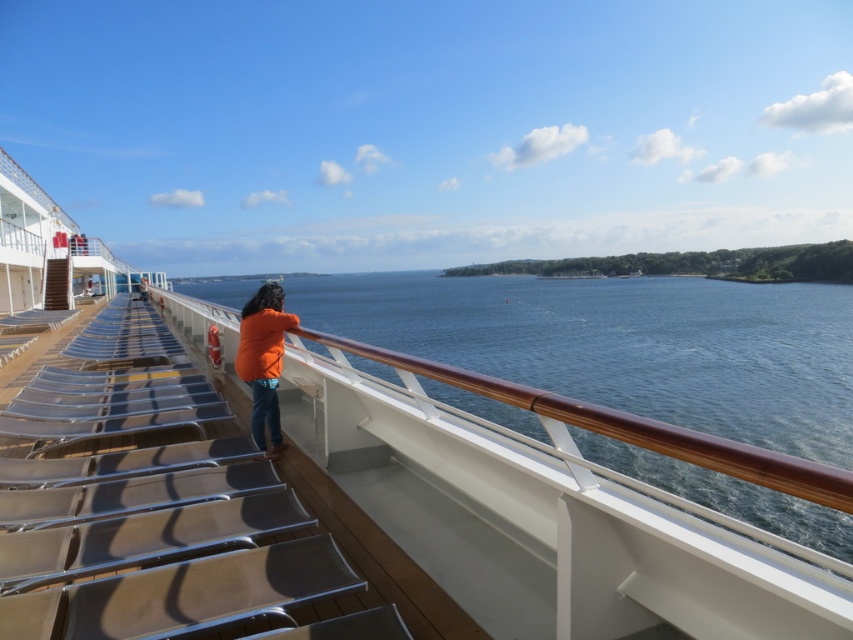
Can you confirm if blue water at center is wider than orange fabric jacket at center?

Correct, the width of blue water at center exceeds that of orange fabric jacket at center.

Is blue water at center to the left of orange fabric jacket at center from the viewer's perspective?

In fact, blue water at center is to the right of orange fabric jacket at center.

This screenshot has width=853, height=640. I want to click on blue water at center, so click(x=625, y=344).